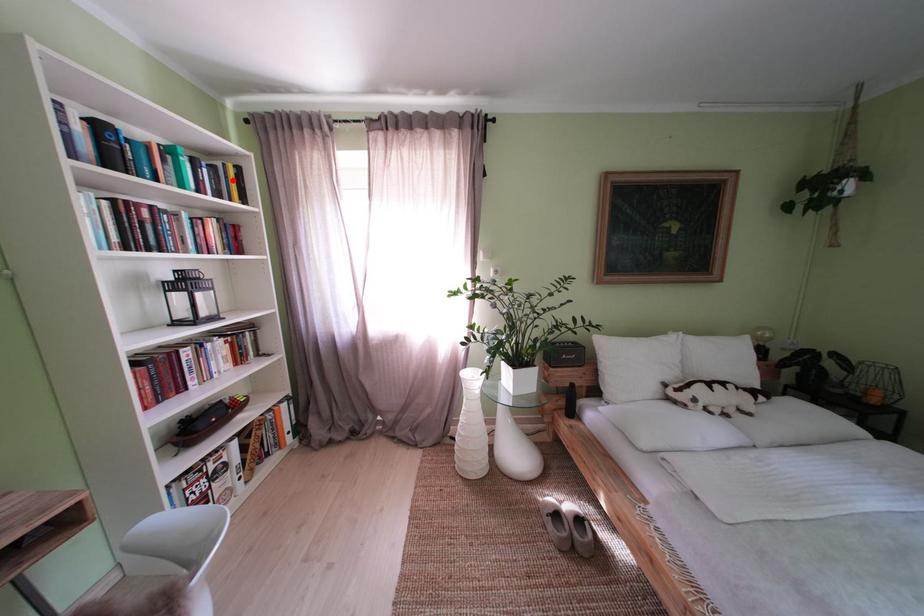
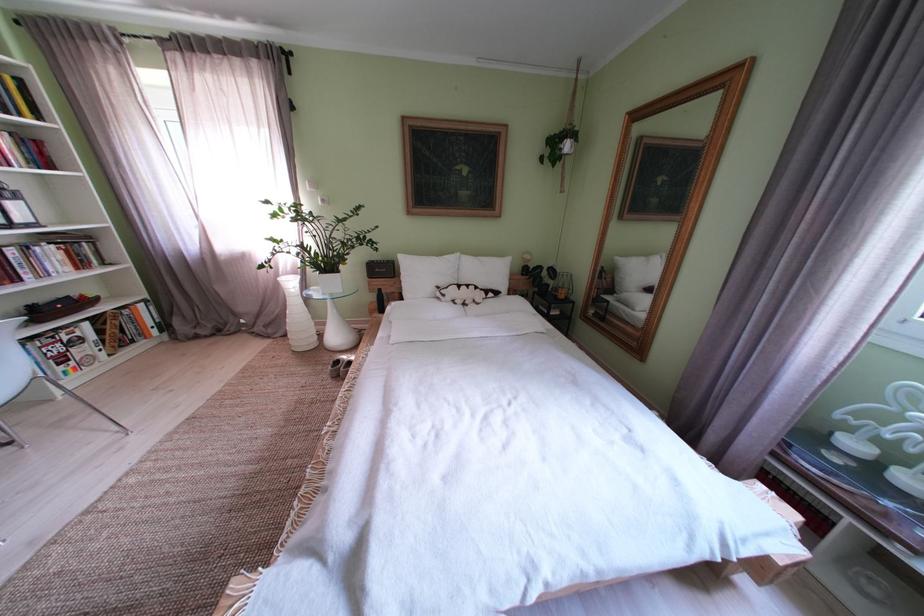
Question: I am providing you with two images of the same scene from different viewpoints. A red point is marked on the first image. Can you still see the location of the red point in image 2?

Choices:
 (A) Yes
 (B) No

Answer: (A)